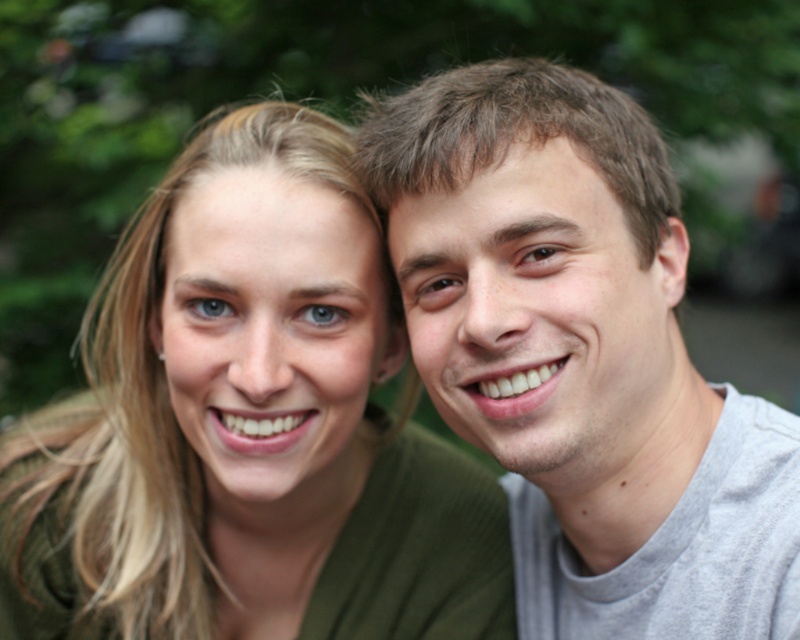
Question: Where is matte green shirt at center located in relation to gray cotton t-shirt at upper right in the image?

Choices:
 (A) right
 (B) left

Answer: (B)

Question: Can you confirm if matte green shirt at center is thinner than gray cotton t-shirt at upper right?

Choices:
 (A) no
 (B) yes

Answer: (A)

Question: Among these objects, which one is nearest to the camera?

Choices:
 (A) gray cotton t-shirt at upper right
 (B) matte green shirt at center

Answer: (A)

Question: Which point appears farthest from the camera in this image?

Choices:
 (A) 660,333
 (B) 141,602

Answer: (B)

Question: Among these points, which one is nearest to the camera?

Choices:
 (A) (528, 81)
 (B) (478, 476)

Answer: (A)

Question: Can you confirm if matte green shirt at center is positioned below gray cotton t-shirt at upper right?

Choices:
 (A) no
 (B) yes

Answer: (B)